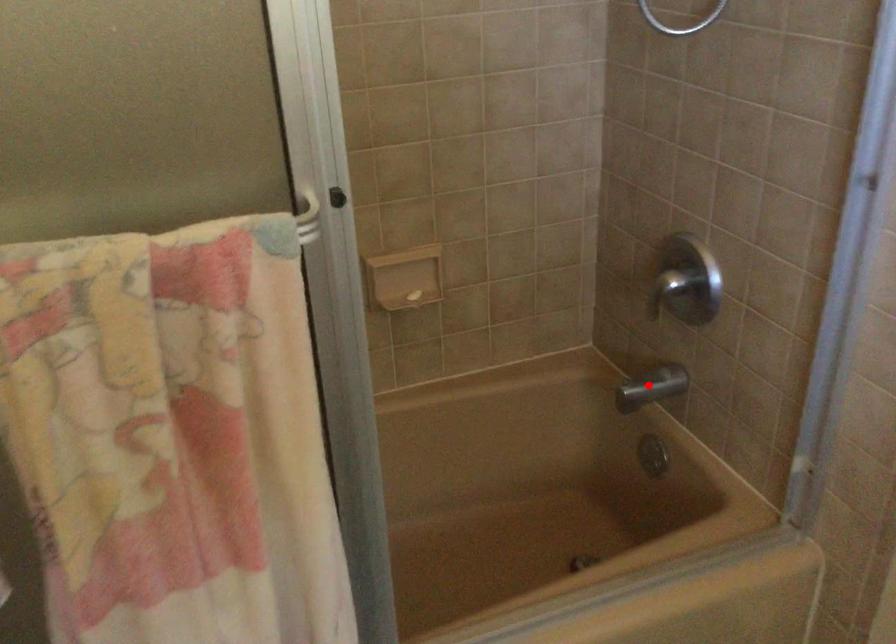
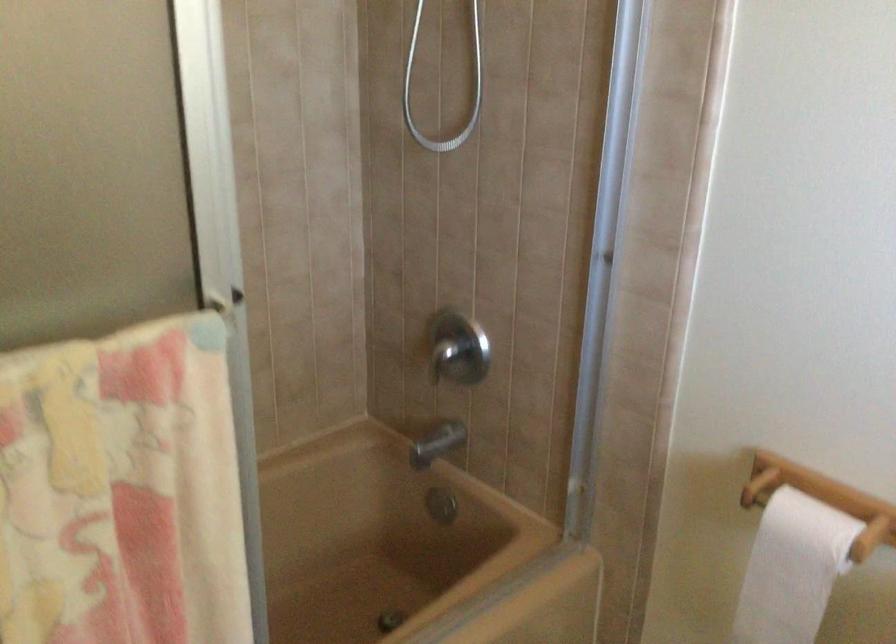
Question: I am providing you with two images of the same scene from different viewpoints. Image1 has a red point marked. In image2, the corresponding 3D location appears at what relative position? Reply with the corresponding letter.

Choices:
 (A) Closer
 (B) Farther

Answer: (B)